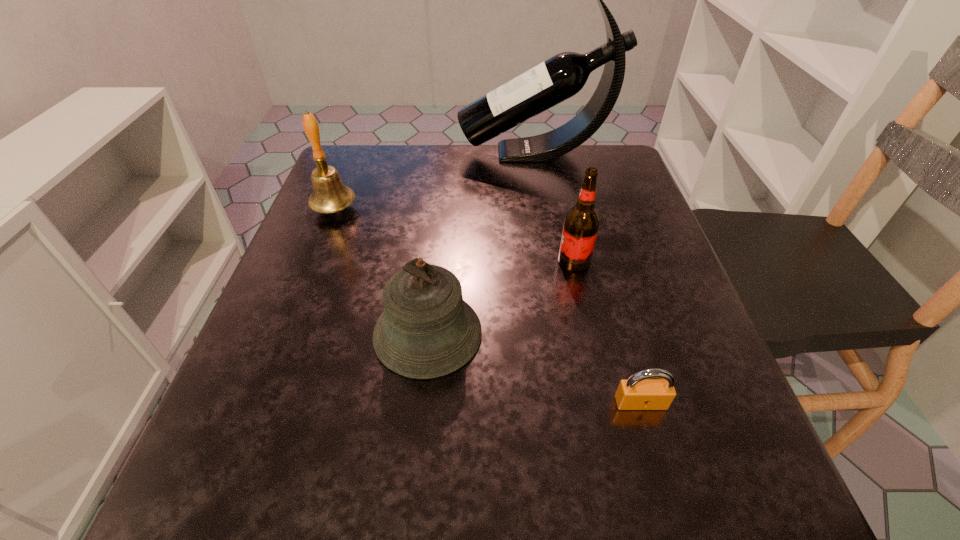
This screenshot has width=960, height=540. In order to click on root beer at the right edge in this screenshot , I will do `click(581, 224)`.

Locate an element on the screen. This screenshot has height=540, width=960. padlock at the right edge is located at coordinates (639, 392).

Locate an element on the screen. object present at the far left corner is located at coordinates (329, 195).

The height and width of the screenshot is (540, 960). Find the location of `object that is positioned at the far right corner`. object that is positioned at the far right corner is located at coordinates (562, 76).

What are the coordinates of `vacant region at the far edge of the desktop` in the screenshot? It's located at (x=444, y=157).

Where is `blank space at the near edge`? blank space at the near edge is located at coordinates (323, 468).

I want to click on free space at the left edge of the desktop, so coord(303,285).

The height and width of the screenshot is (540, 960). What are the coordinates of `vacant area at the right edge` in the screenshot? It's located at (636, 310).

At what (x,y) coordinates should I click in order to perform the action: click on vacant space at the near left corner of the desktop. Please return your answer as a coordinate pair (x, y). The image size is (960, 540). Looking at the image, I should click on (251, 518).

At what (x,y) coordinates should I click in order to perform the action: click on free point at the far right corner. Please return your answer as a coordinate pair (x, y). Image resolution: width=960 pixels, height=540 pixels. Looking at the image, I should click on (605, 187).